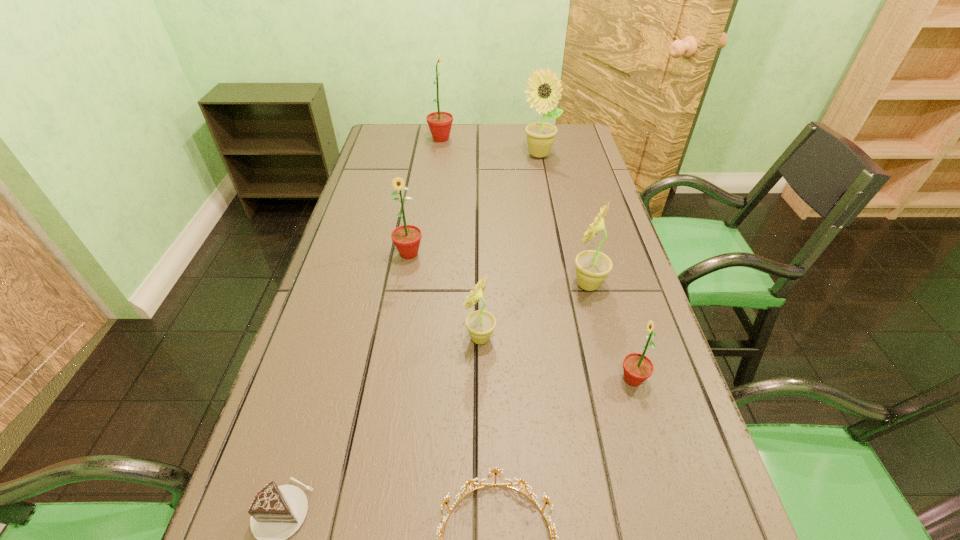
Locate an element on the screen. This screenshot has width=960, height=540. vacant space located on the face of the fourth nearest object is located at coordinates (383, 338).

What are the coordinates of `free space located on the face of the nearest green sunflower` in the screenshot? It's located at (568, 380).

The image size is (960, 540). Identify the location of vacant space located 0.170m on the face of the nearest green sunflower. (535, 380).

Locate an element on the screen. The height and width of the screenshot is (540, 960). free space located on the face of the nearest green sunflower is located at coordinates (470, 380).

Where is `object situated at the far right corner`? Image resolution: width=960 pixels, height=540 pixels. object situated at the far right corner is located at coordinates (544, 89).

At what (x,y) coordinates should I click in order to perform the action: click on free spot at the left edge of the desktop. Please return your answer as a coordinate pair (x, y). Looking at the image, I should click on (317, 327).

Locate an element on the screen. The image size is (960, 540). vacant position at the right edge of the desktop is located at coordinates coord(569,171).

Find the location of a particular element. free space that is in between the third farthest object and the third nearest object is located at coordinates (521, 316).

Locate an element on the screen. The width and height of the screenshot is (960, 540). free space that is in between the smallest yellow sunflower and the third nearest object is located at coordinates (557, 359).

This screenshot has height=540, width=960. In order to click on vacant point located between the biggest green sunflower and the biggest yellow sunflower in this screenshot , I will do `click(490, 147)`.